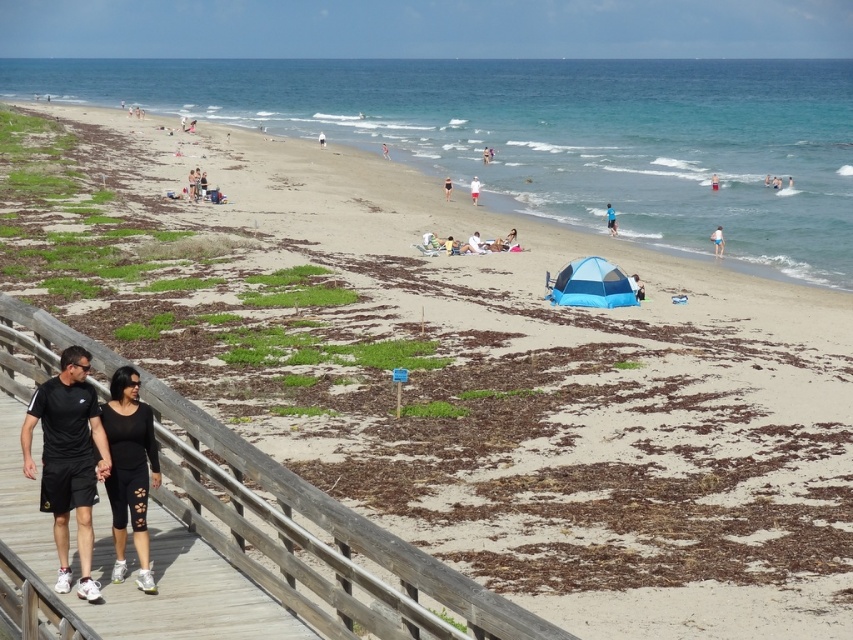
Between black athletic wear at lower left and white fabric shorts at lower right, which one is positioned higher?

Positioned higher is white fabric shorts at lower right.

From the picture: Can you confirm if black athletic wear at lower left is positioned to the right of white fabric shorts at lower right?

No, black athletic wear at lower left is not to the right of white fabric shorts at lower right.

This screenshot has height=640, width=853. Describe the element at coordinates (68, 460) in the screenshot. I see `black athletic wear at lower left` at that location.

Image resolution: width=853 pixels, height=640 pixels. Find the location of `black athletic wear at lower left`. black athletic wear at lower left is located at coordinates (68, 460).

Is wooden at lower left to the left of black matte leggings at lower left from the viewer's perspective?

Yes, wooden at lower left is to the left of black matte leggings at lower left.

How far apart are wooden at lower left and black matte leggings at lower left?

The distance of wooden at lower left from black matte leggings at lower left is 4.98 feet.

You are a GUI agent. You are given a task and a screenshot of the screen. Output one action in this format:
    pyautogui.click(x=<x>, y=<y>)
    Task: Click on the wooden at lower left
    The image size is (853, 640).
    Given the screenshot: What is the action you would take?
    pyautogui.click(x=314, y=540)

Between black athletic wear at lower left and white fabric umbrella at center, which one appears on the left side from the viewer's perspective?

black athletic wear at lower left is more to the left.

Which is behind, point (62, 387) or point (479, 188)?

Positioned behind is point (479, 188).

Which is behind, point (44, 403) or point (474, 179)?

The point (474, 179) is behind.

Image resolution: width=853 pixels, height=640 pixels. I want to click on black athletic wear at lower left, so click(x=68, y=460).